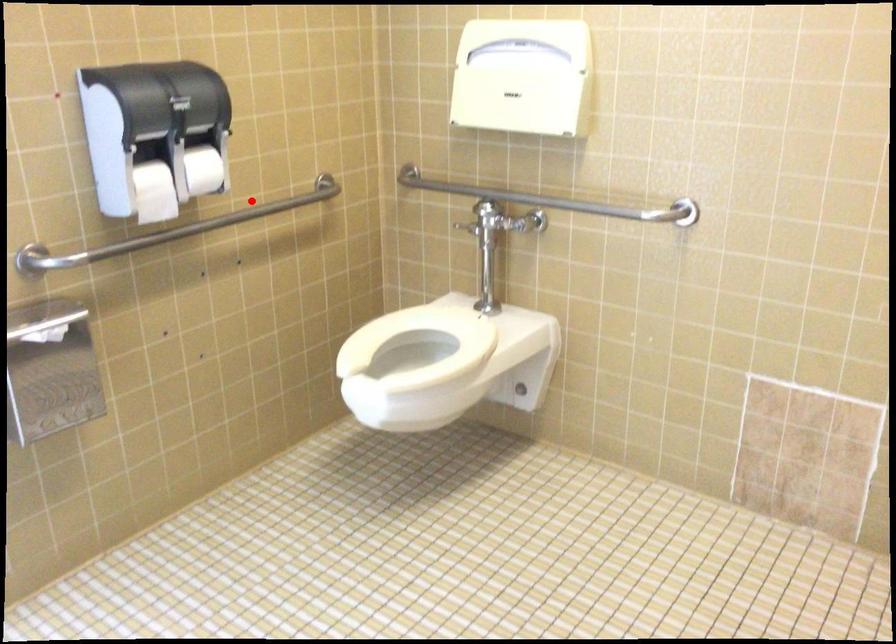
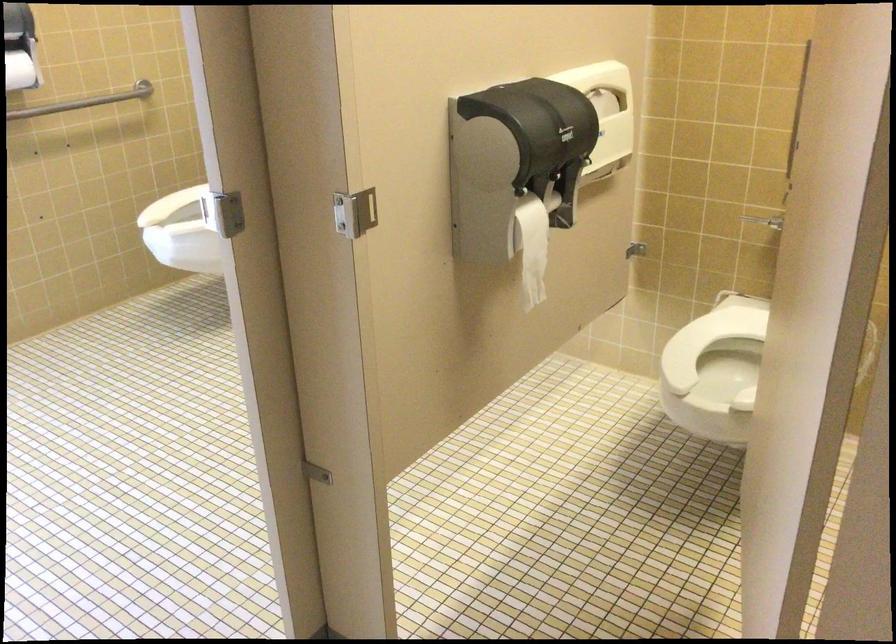
Question: I am providing you with two images of the same scene from different viewpoints. A red point is marked on the first image. At the location where the point appears in image 1, is it still visible in image 2?

Choices:
 (A) Yes
 (B) No

Answer: (A)